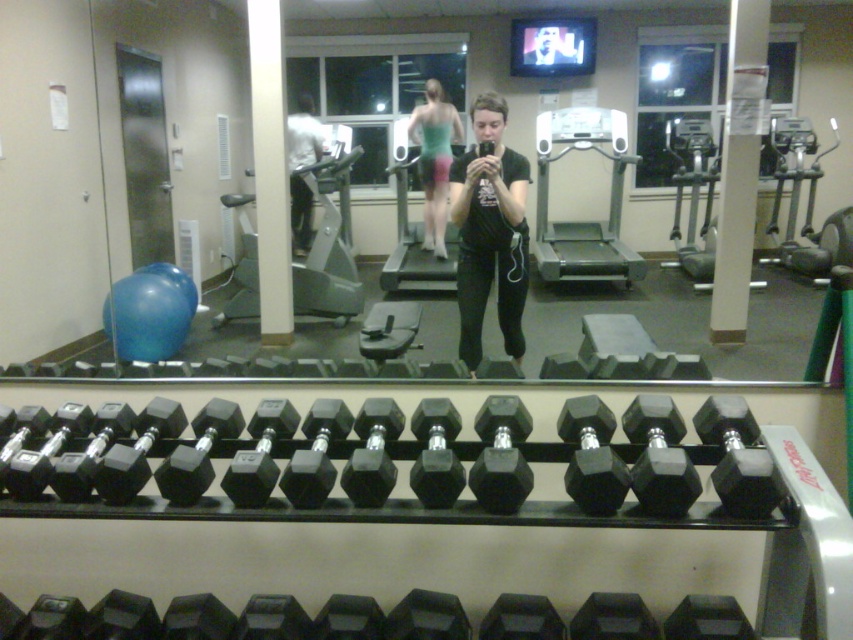
You are a gym trainer planning to place a new equipment between the black rubber dumbbell at center and the gray rubber treadmill at center. The new equipment requires a space that is wider than the wider of the two. Which equipment should you consider the width of when determining the required space?

The black rubber dumbbell at center is wider than the gray rubber treadmill at center. Therefore, you should consider the width of the black rubber dumbbell at center when determining the required space for the new equipment.

You are a gym member trying to identify two people in the mirror reflection. You see a black matte shirt at center and a teal matte tank top at center. Which one is positioned lower in the reflection?

The black matte shirt at center is located below the teal matte tank top at center in the reflection.

You are a gym member trying to locate your belongings. You see a black hexagonal dumbbell at center and a matte white shirt at center. Which object is positioned to the right in the scene?

The black hexagonal dumbbell at center is to the right of the matte white shirt at center.